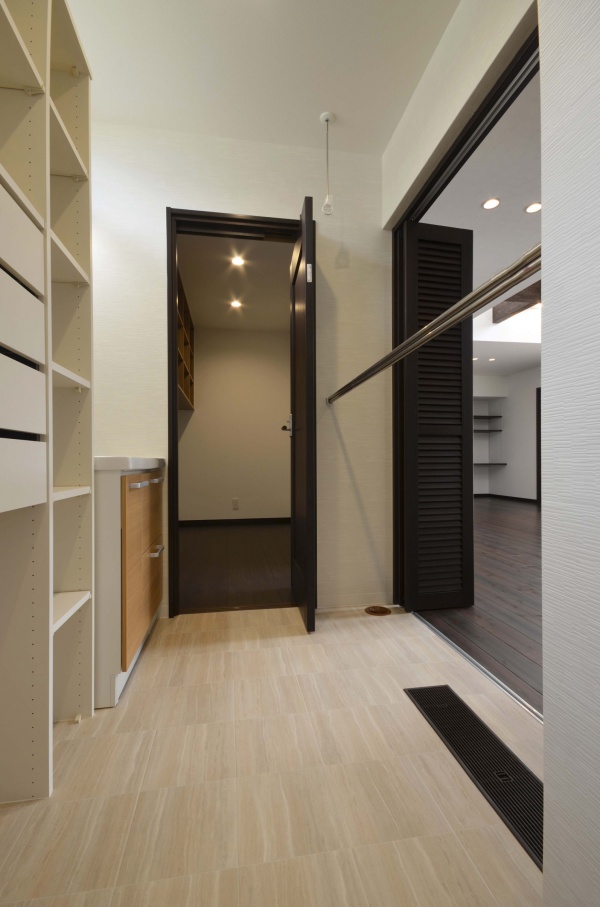
You are a GUI agent. You are given a task and a screenshot of the screen. Output one action in this format:
    pyautogui.click(x=<x>, y=<y>)
    Task: Click on the wall
    The image size is (600, 907).
    Given the screenshot: What is the action you would take?
    pyautogui.click(x=525, y=424), pyautogui.click(x=234, y=470), pyautogui.click(x=121, y=407)